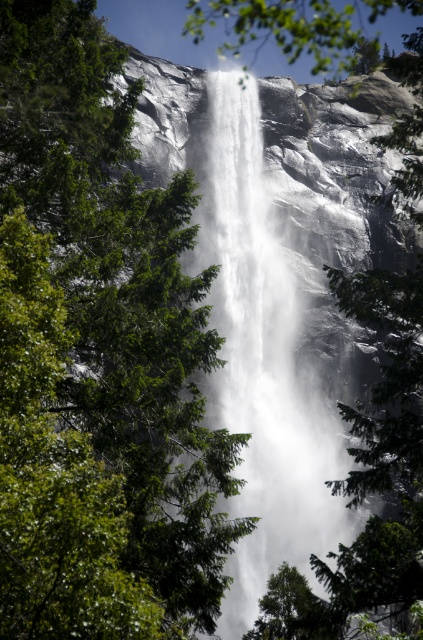
Does point (52, 97) lie behind point (299, 376)?

That is False.

Can you confirm if green leafy tree at center is positioned to the right of white frothy water at center?

Incorrect, green leafy tree at center is not on the right side of white frothy water at center.

Is point (44, 483) farther from viewer compared to point (305, 570)?

No, it is in front of (305, 570).

At what (x,y) coordinates should I click in order to perform the action: click on green leafy tree at center. Please return your answer as a coordinate pair (x, y). The width and height of the screenshot is (423, 640). Looking at the image, I should click on (98, 358).